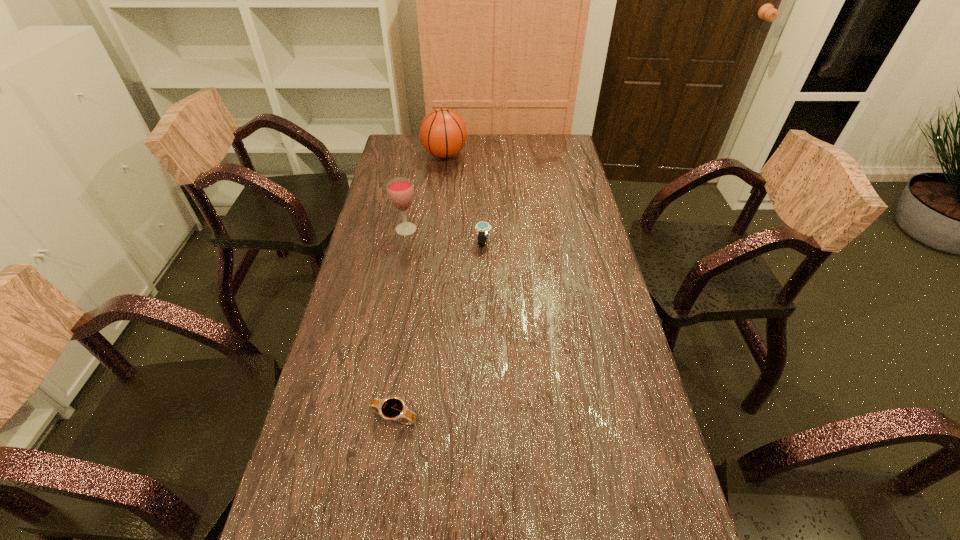
Locate an element on the screen. free point between the farther watch and the nearest object is located at coordinates (439, 329).

Locate an element on the screen. This screenshot has height=540, width=960. blank region between the wineglass and the taller watch is located at coordinates (444, 236).

Where is `empty space that is in between the rightmost object and the wineglass`? This screenshot has width=960, height=540. empty space that is in between the rightmost object and the wineglass is located at coordinates (444, 236).

Identify the location of free space between the rightmost object and the wineglass. The image size is (960, 540). (444, 236).

Identify the location of vacant space in between the wineglass and the second shortest object. The width and height of the screenshot is (960, 540). (444, 236).

At what (x,y) coordinates should I click in order to perform the action: click on free space that is in between the nearest object and the wineglass. Please return your answer as a coordinate pair (x, y). This screenshot has height=540, width=960. Looking at the image, I should click on (400, 323).

Where is `free space between the basketball and the wineglass`? Image resolution: width=960 pixels, height=540 pixels. free space between the basketball and the wineglass is located at coordinates (425, 192).

Find the location of a particular element. The image size is (960, 540). vacant area between the wineglass and the basketball is located at coordinates (425, 192).

I want to click on empty location between the shortest object and the wineglass, so click(400, 323).

At what (x,y) coordinates should I click in order to perform the action: click on free space between the wineglass and the basketball. Please return your answer as a coordinate pair (x, y). Image resolution: width=960 pixels, height=540 pixels. Looking at the image, I should click on (425, 192).